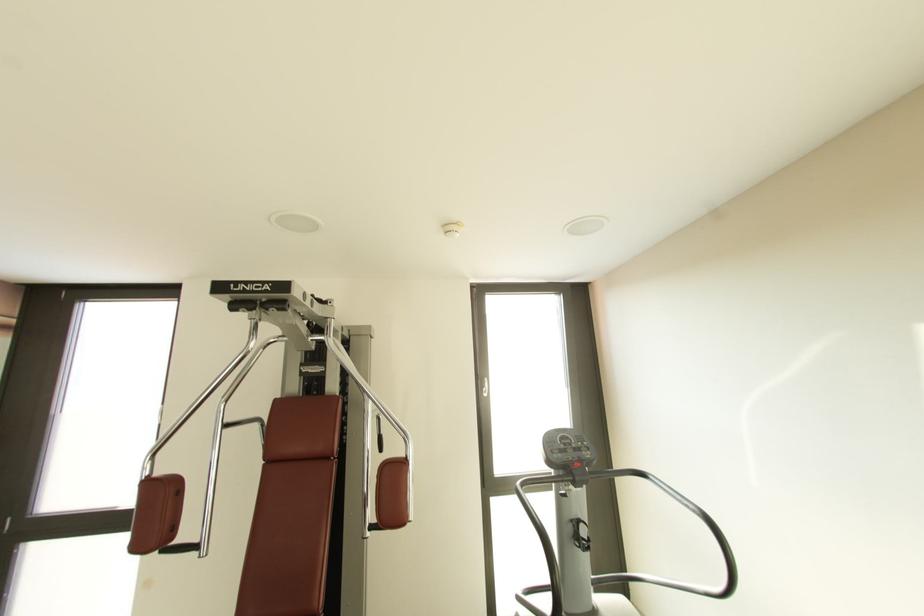
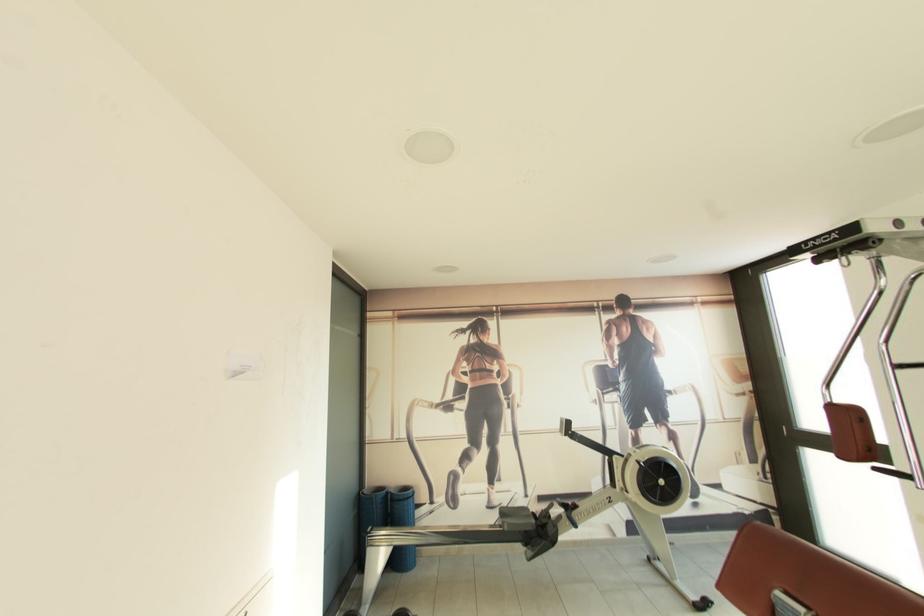
Question: The camera is either moving clockwise (left) or counter-clockwise (right) around the object. The first image is from the beginning of the video and the second image is from the end. Is the camera moving left or right when shooting the video?

Choices:
 (A) Left
 (B) Right

Answer: (B)